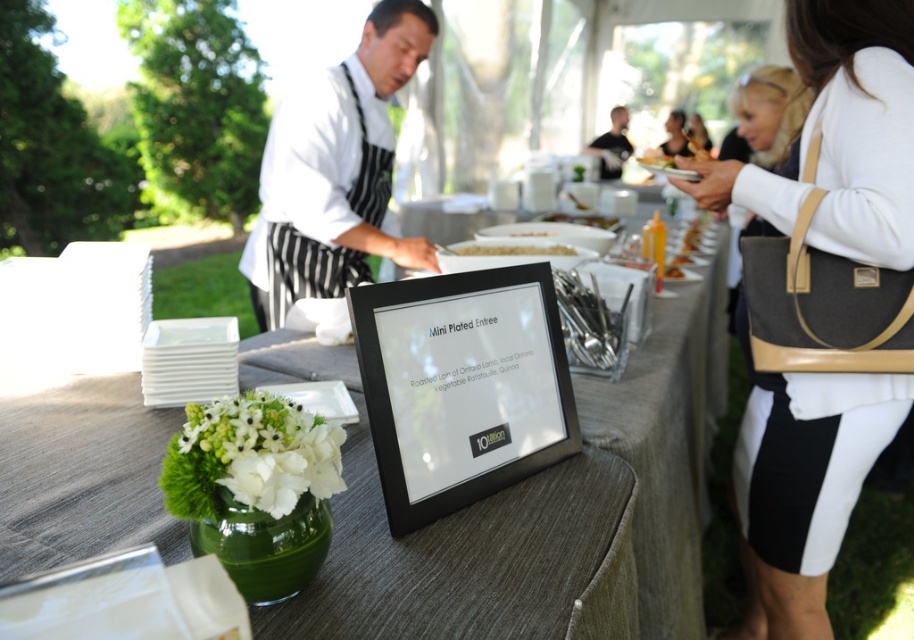
Based on the photo, who is more distant from viewer, (614, 612) or (465, 252)?

Point (465, 252)

Is point (17, 497) closer to camera compared to point (528, 244)?

Yes, point (17, 497) is in front of point (528, 244).

You are a GUI agent. You are given a task and a screenshot of the screen. Output one action in this format:
    pyautogui.click(x=<x>, y=<y>)
    Task: Click on the matte black frame at center
    The height and width of the screenshot is (640, 914).
    Given the screenshot: What is the action you would take?
    pyautogui.click(x=533, y=506)

Is dark gray shirt at upper center to the left of smooth white plate at center from the viewer's perspective?

In fact, dark gray shirt at upper center is to the right of smooth white plate at center.

Does point (600, 156) come in front of point (615, 225)?

No.

Describe the element at coordinates (612, 145) in the screenshot. I see `dark gray shirt at upper center` at that location.

This screenshot has width=914, height=640. What are the coordinates of `dark gray shirt at upper center` in the screenshot? It's located at (612, 145).

Is matte black frame at center to the right of white textured sweater at upper right from the viewer's perspective?

Incorrect, matte black frame at center is not on the right side of white textured sweater at upper right.

Is the position of matte black frame at center less distant than that of white textured sweater at upper right?

Yes, matte black frame at center is closer to the viewer.

Find the location of a particular element. This screenshot has width=914, height=640. matte black frame at center is located at coordinates (533, 506).